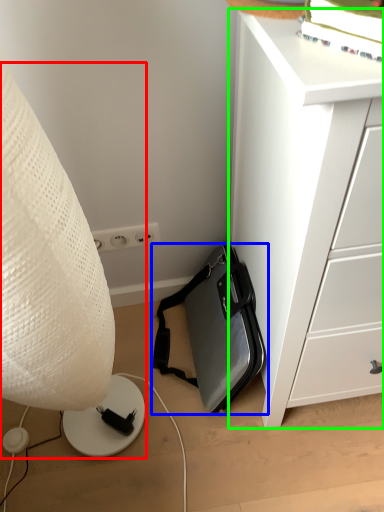
Question: Considering the real-world distances, which object is closest to lamp (highlighted by a red box)? luggage and bags (highlighted by a blue box) or chest of drawers (highlighted by a green box).

Choices:
 (A) luggage and bags
 (B) chest of drawers

Answer: (B)